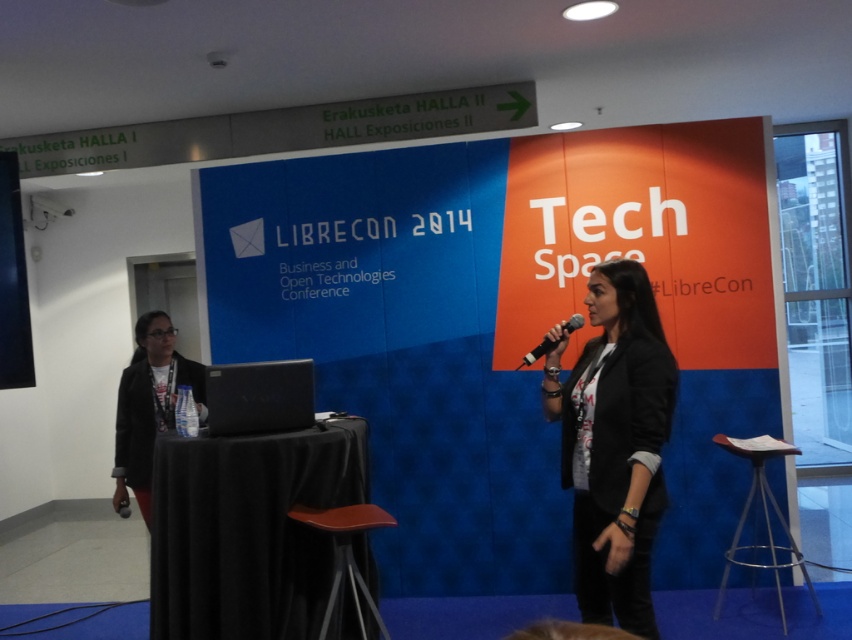
Question: Where is black matte blazer at center located in relation to wooden stool at center in the image?

Choices:
 (A) below
 (B) above

Answer: (B)

Question: Which point is closer to the camera taking this photo?

Choices:
 (A) (536, 355)
 (B) (148, 397)
 (C) (294, 508)

Answer: (A)

Question: Which point is farther to the camera?

Choices:
 (A) (643, 529)
 (B) (525, 356)

Answer: (B)

Question: Which object appears closest to the camera in this image?

Choices:
 (A) matte black jacket at left
 (B) wooden stool at center
 (C) black matte blazer at center
 (D) black matte microphone at center

Answer: (C)

Question: Is black matte blazer at center bigger than wooden stool at center?

Choices:
 (A) no
 (B) yes

Answer: (B)

Question: From the image, what is the correct spatial relationship of black matte blazer at center in relation to matte black jacket at left?

Choices:
 (A) above
 (B) below

Answer: (A)